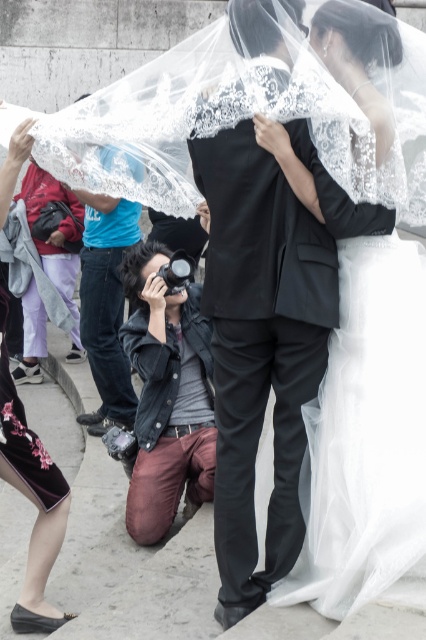
Who is more forward, (189, 474) or (17, 618)?

Point (17, 618) is in front.

Can you confirm if denim jacket at lower center is positioned to the left of velvet skirt at lower left?

No, denim jacket at lower center is not to the left of velvet skirt at lower left.

The height and width of the screenshot is (640, 426). I want to click on denim jacket at lower center, so click(166, 396).

Measure the distance from white lace veil at center to matte black camera at center.

white lace veil at center and matte black camera at center are 3.20 meters apart.

Does white lace veil at center have a greater width compared to matte black camera at center?

Indeed, white lace veil at center has a greater width compared to matte black camera at center.

Measure the distance between white lace veil at center and camera.

white lace veil at center is 3.52 meters away from camera.

Where is `white lace veil at center`? The width and height of the screenshot is (426, 640). white lace veil at center is located at coordinates coord(368,438).

Is the position of white lace veil at center less distant than that of velvet skirt at lower left?

That is True.

Which is behind, point (345, 296) or point (69, 612)?

The point (69, 612) is behind.

Locate an element on the screen. white lace veil at center is located at coordinates (368, 438).